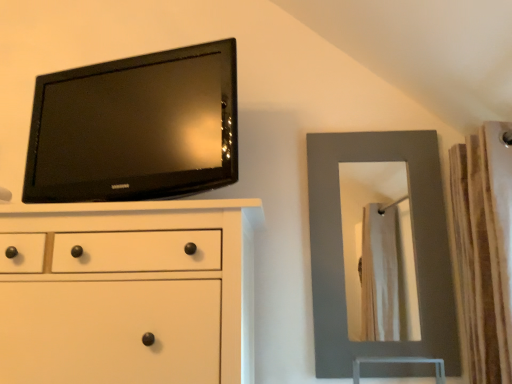
Question: Considering the positions of matte gray mirror at right and black glossy tv at upper left in the image, is matte gray mirror at right bigger or smaller than black glossy tv at upper left?

Choices:
 (A) small
 (B) big

Answer: (A)

Question: Is point (422, 137) closer or farther from the camera than point (129, 200)?

Choices:
 (A) closer
 (B) farther

Answer: (B)

Question: Which object is the farthest from the brown textured curtain at right?

Choices:
 (A) black glossy tv at upper left
 (B) matte gray mirror at right
 (C) matte white chest of drawers at upper left

Answer: (A)

Question: Estimate the real-world distances between objects in this image. Which object is closer to the matte gray mirror at right?

Choices:
 (A) black glossy tv at upper left
 (B) brown textured curtain at right
 (C) matte white chest of drawers at upper left

Answer: (B)